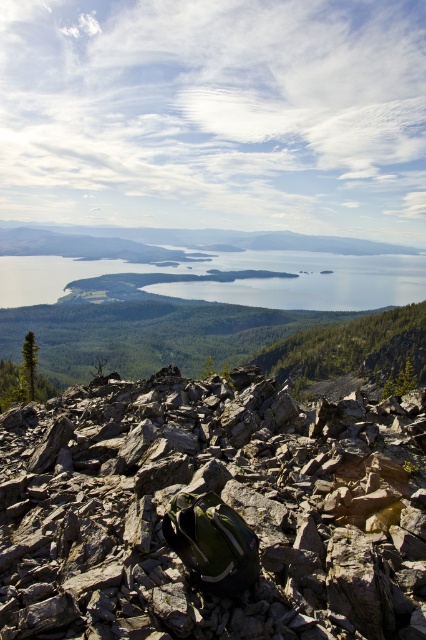
Does gray rocky boulder at center appear over green textured hillside at center?

No, gray rocky boulder at center is not above green textured hillside at center.

Can you confirm if gray rocky boulder at center is smaller than green textured hillside at center?

Yes.

Is point (155, 451) positioned behind point (302, 332)?

No, it is in front of (302, 332).

Where is `gray rocky boulder at center`? gray rocky boulder at center is located at coordinates (210, 513).